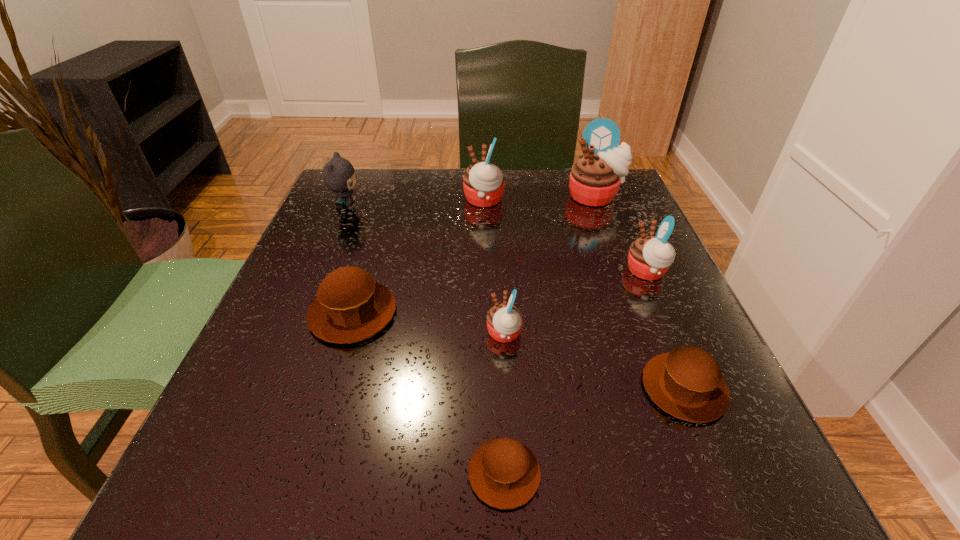
Find the location of `the tallest muffin`. the tallest muffin is located at coordinates (595, 178).

Where is `the biggest pink muffin`? The width and height of the screenshot is (960, 540). the biggest pink muffin is located at coordinates (595, 178).

Identify the location of the third smallest pink muffin. (483, 183).

Locate an element on the screen. This screenshot has width=960, height=540. the second tallest muffin is located at coordinates (483, 183).

This screenshot has width=960, height=540. What are the coordinates of `gray kitten` in the screenshot? It's located at (x=339, y=176).

I want to click on the second smallest pink muffin, so click(x=649, y=258).

You are a GUI agent. You are given a task and a screenshot of the screen. Output one action in this format:
    pyautogui.click(x=<x>, y=<y>)
    Task: Click on the second nearest pink muffin
    The height and width of the screenshot is (540, 960).
    Given the screenshot: What is the action you would take?
    pyautogui.click(x=649, y=258)

At what (x,y) coordinates should I click in order to perform the action: click on the smallest pink muffin. Please return your answer as a coordinate pair (x, y). This screenshot has width=960, height=540. Looking at the image, I should click on click(504, 321).

This screenshot has width=960, height=540. Find the location of `the farthest brown muffin`. the farthest brown muffin is located at coordinates (350, 306).

At what (x,y) coordinates should I click in order to perform the action: click on the leftmost muffin. Please return your answer as a coordinate pair (x, y). This screenshot has height=540, width=960. Looking at the image, I should click on click(350, 306).